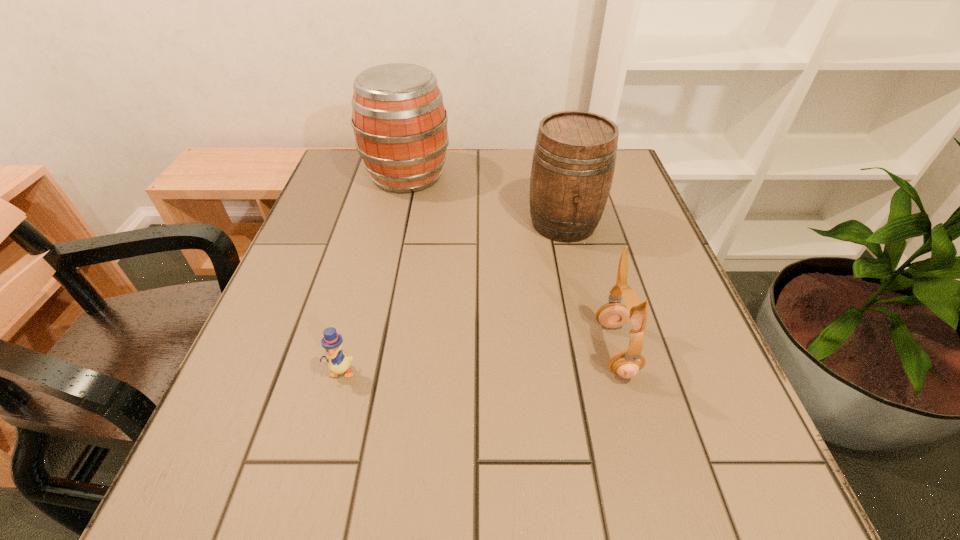
Find the location of a particular element. The width and height of the screenshot is (960, 540). blank area located 0.380m on the front-facing side of the earphone is located at coordinates (389, 349).

Find the location of `vacant position located on the face of the duckling, where the monocle is placed`. vacant position located on the face of the duckling, where the monocle is placed is located at coordinates (326, 425).

Locate an element on the screen. The height and width of the screenshot is (540, 960). object located at the far edge is located at coordinates (399, 120).

At what (x,y) coordinates should I click in order to perform the action: click on cider at the left edge. Please return your answer as a coordinate pair (x, y). The width and height of the screenshot is (960, 540). Looking at the image, I should click on (399, 120).

You are a GUI agent. You are given a task and a screenshot of the screen. Output one action in this format:
    pyautogui.click(x=<x>, y=<y>)
    Task: Click on the duckling located in the left edge section of the desktop
    
    Given the screenshot: What is the action you would take?
    pyautogui.click(x=338, y=363)

This screenshot has width=960, height=540. In order to click on cider that is at the right edge in this screenshot , I will do `click(574, 157)`.

Find the location of a particular element. earphone present at the right edge is located at coordinates (626, 363).

You are a GUI agent. You are given a task and a screenshot of the screen. Output one action in this format:
    pyautogui.click(x=<x>, y=<y>)
    Task: Click on the object positioned at the far left corner
    
    Given the screenshot: What is the action you would take?
    pyautogui.click(x=399, y=120)

Where is `free point at the far edge`? free point at the far edge is located at coordinates (498, 191).

In the image, there is a desktop. At what (x,y) coordinates should I click in order to perform the action: click on blank space at the near edge. Please return your answer as a coordinate pair (x, y). This screenshot has height=540, width=960. Looking at the image, I should click on (x=406, y=511).